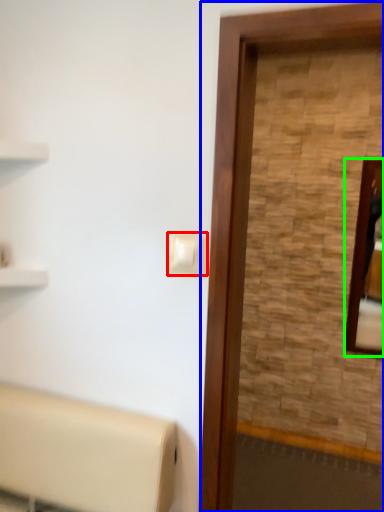
Question: Estimate the real-world distances between objects in this image. Which object is farther from light switch (highlighted by a red box), screen door (highlighted by a blue box) or mirror (highlighted by a green box)?

Choices:
 (A) screen door
 (B) mirror

Answer: (B)